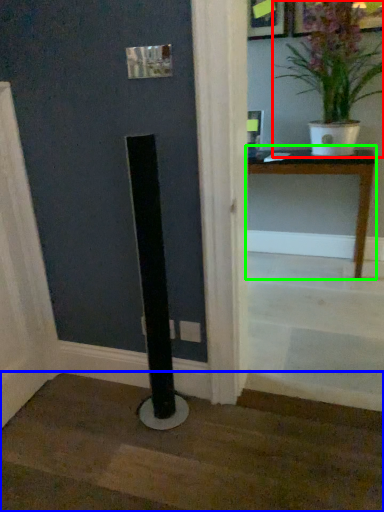
Question: Estimate the real-world distances between objects in this image. Which object is farther from houseplant (highlighted by a red box), stairwell (highlighted by a blue box) or table (highlighted by a green box)?

Choices:
 (A) stairwell
 (B) table

Answer: (A)